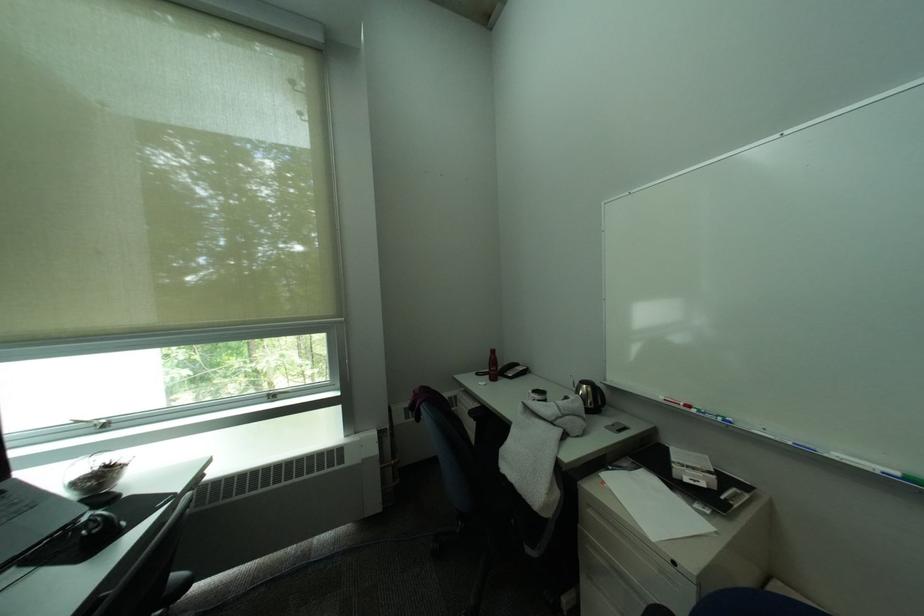
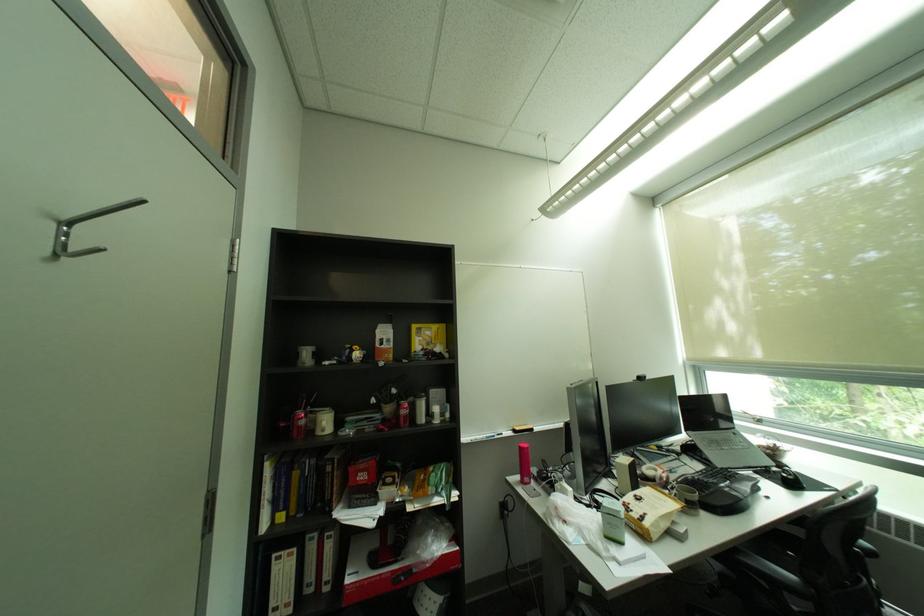
The point at (75, 529) is marked in the first image. Where is the corresponding point in the second image?

(777, 468)